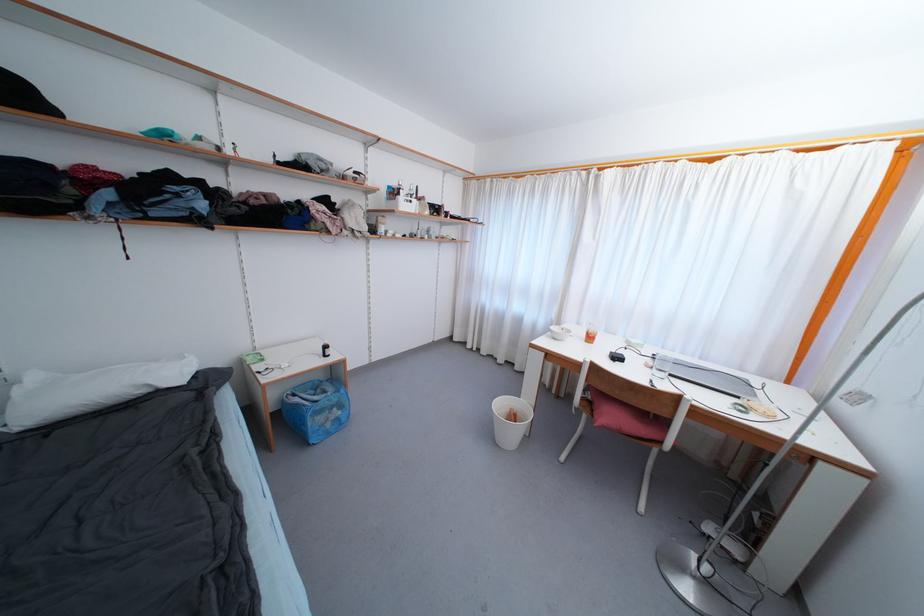
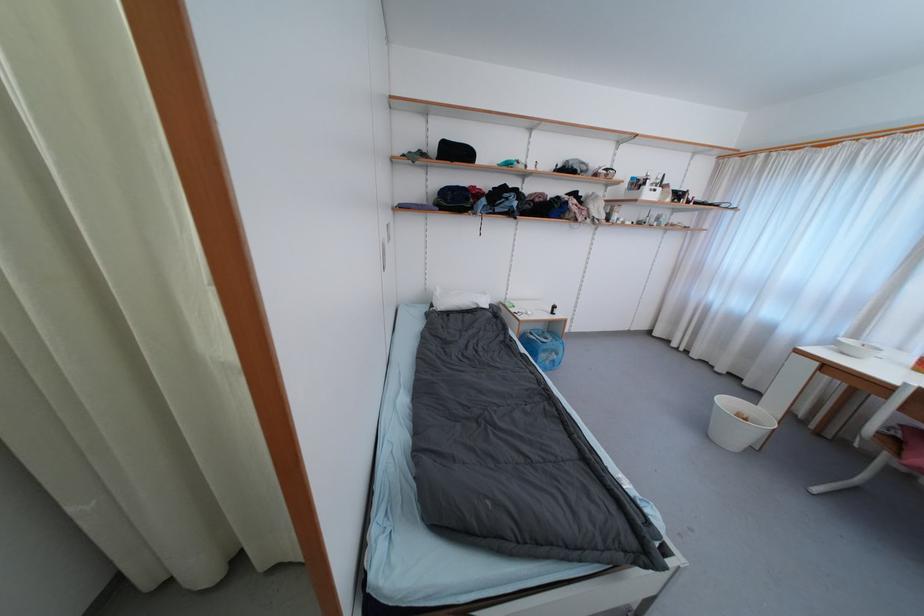
Find the pixel in the second image that matches (505,407) in the first image.

(732, 405)